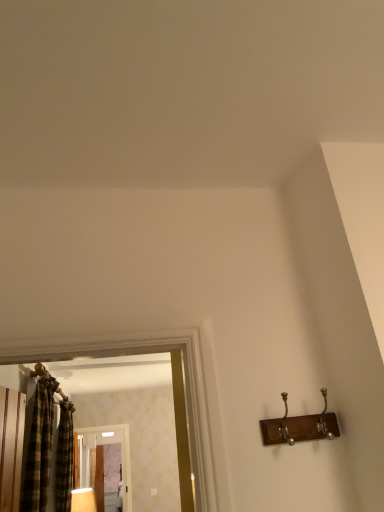
Question: Is plaid fabric shower curtain at left oriented away from plaid fabric curtain at left?

Choices:
 (A) yes
 (B) no

Answer: (B)

Question: From the image's perspective, is plaid fabric shower curtain at left located beneath plaid fabric curtain at left?

Choices:
 (A) yes
 (B) no

Answer: (A)

Question: Can you confirm if plaid fabric shower curtain at left is bigger than plaid fabric curtain at left?

Choices:
 (A) yes
 (B) no

Answer: (B)

Question: Does plaid fabric shower curtain at left come in front of plaid fabric curtain at left?

Choices:
 (A) yes
 (B) no

Answer: (B)

Question: Can you confirm if plaid fabric shower curtain at left is thinner than plaid fabric curtain at left?

Choices:
 (A) yes
 (B) no

Answer: (A)

Question: From the image's perspective, is clear glass screen door at center positioned above or below plaid fabric shower curtain at left?

Choices:
 (A) below
 (B) above

Answer: (A)

Question: Is point (129, 468) positioned closer to the camera than point (61, 472)?

Choices:
 (A) closer
 (B) farther

Answer: (B)

Question: From a real-world perspective, is clear glass screen door at center positioned above or below plaid fabric shower curtain at left?

Choices:
 (A) above
 (B) below

Answer: (B)

Question: Is clear glass screen door at center in front of or behind plaid fabric shower curtain at left in the image?

Choices:
 (A) behind
 (B) front

Answer: (A)

Question: Considering the positions of plaid fabric shower curtain at left and matte wooden lamp at lower left in the image, is plaid fabric shower curtain at left wider or thinner than matte wooden lamp at lower left?

Choices:
 (A) wide
 (B) thin

Answer: (B)

Question: Is plaid fabric shower curtain at left to the left or to the right of matte wooden lamp at lower left in the image?

Choices:
 (A) left
 (B) right

Answer: (A)

Question: Which is correct: plaid fabric shower curtain at left is inside matte wooden lamp at lower left, or outside of it?

Choices:
 (A) inside
 (B) outside

Answer: (B)

Question: In terms of size, does plaid fabric shower curtain at left appear bigger or smaller than matte wooden lamp at lower left?

Choices:
 (A) small
 (B) big

Answer: (B)

Question: From the image's perspective, is wooden hanger at upper left located above or below plaid fabric shower curtain at left?

Choices:
 (A) below
 (B) above

Answer: (B)

Question: Does point (61, 389) appear closer or farther from the camera than point (61, 458)?

Choices:
 (A) closer
 (B) farther

Answer: (B)